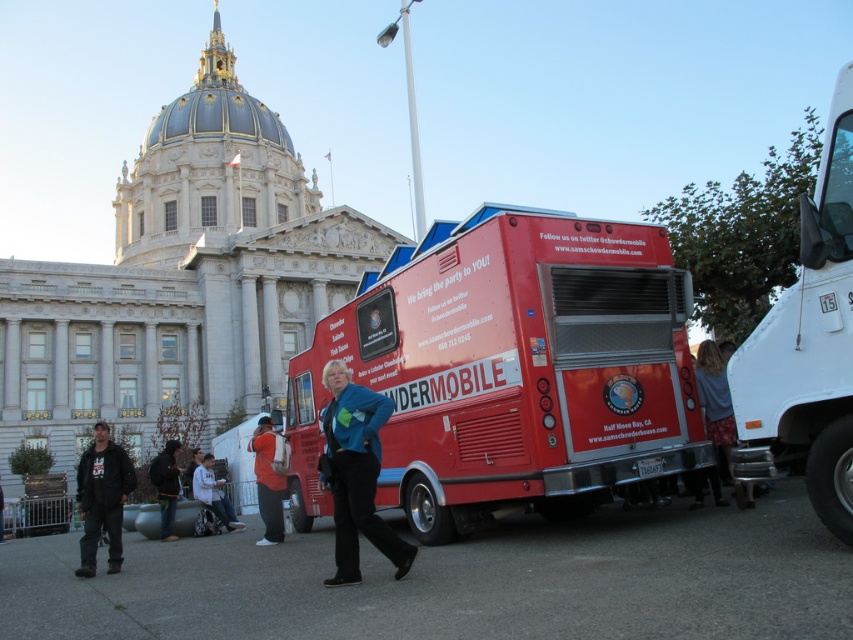
Question: Which point is farther from the camera taking this photo?

Choices:
 (A) (805, 307)
 (B) (271, 456)
 (C) (334, 508)

Answer: (B)

Question: Estimate the real-world distances between objects in this image. Which object is farther from the white glossy truck at right?

Choices:
 (A) shiny red food truck at center
 (B) dark blue jeans at lower left
 (C) orange cotton hoodie at center

Answer: (B)

Question: Does white glossy truck at right appear on the right side of orange cotton hoodie at center?

Choices:
 (A) no
 (B) yes

Answer: (B)

Question: Does dark gray jacket at lower left appear on the right side of denim jacket at lower center?

Choices:
 (A) no
 (B) yes

Answer: (A)

Question: Is blue denim jeans at lower right wider than denim jacket at lower center?

Choices:
 (A) yes
 (B) no

Answer: (B)

Question: Which of the following is the farthest from the observer?

Choices:
 (A) (434, 276)
 (B) (762, 356)
 (C) (221, 492)

Answer: (C)